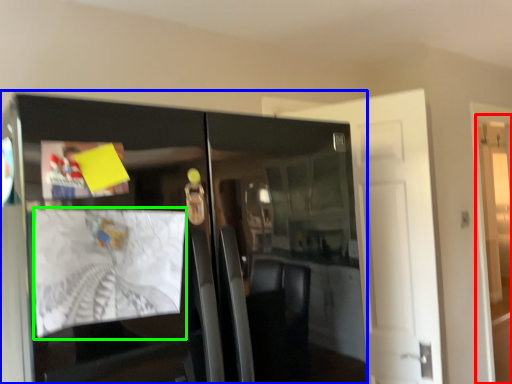
Question: Considering the real-world distances, which object is closest to door (highlighted by a red box)? cabinetry (highlighted by a blue box) or magazine (highlighted by a green box).

Choices:
 (A) cabinetry
 (B) magazine

Answer: (A)